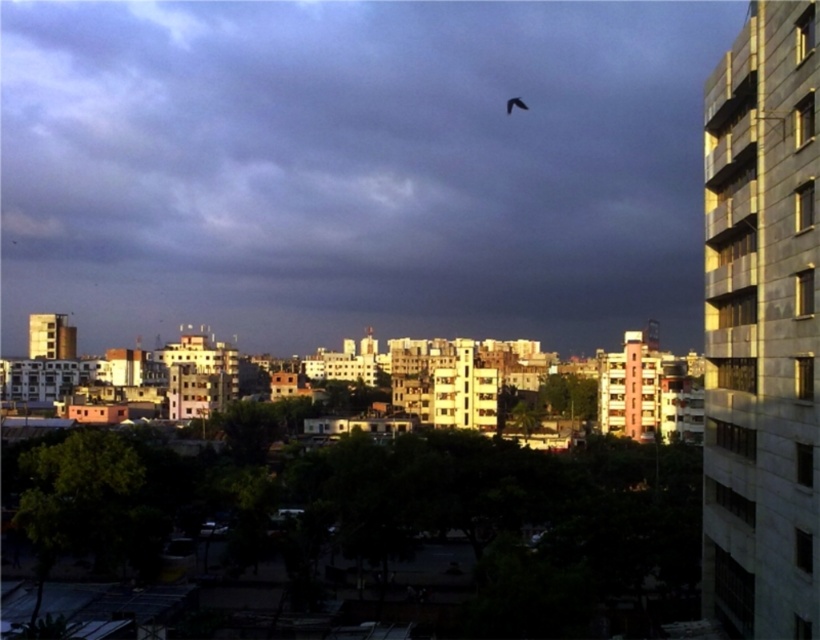
Question: Is dark gray cloud at upper center wider than silhouette feathered bird at upper center?

Choices:
 (A) no
 (B) yes

Answer: (B)

Question: Among these points, which one is nearest to the camera?

Choices:
 (A) (x=516, y=99)
 (B) (x=433, y=8)

Answer: (A)

Question: Among these objects, which one is farthest from the camera?

Choices:
 (A) dark gray cloud at upper center
 (B) silhouette feathered bird at upper center

Answer: (B)

Question: Considering the relative positions of dark gray cloud at upper center and silhouette feathered bird at upper center in the image provided, where is dark gray cloud at upper center located with respect to silhouette feathered bird at upper center?

Choices:
 (A) left
 (B) right

Answer: (A)

Question: Is dark gray cloud at upper center closer to camera compared to silhouette feathered bird at upper center?

Choices:
 (A) no
 (B) yes

Answer: (B)